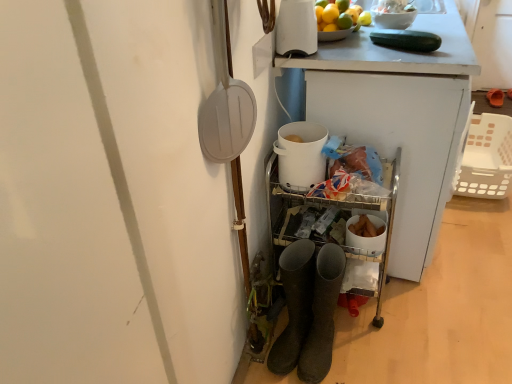
Question: Is white glossy bowl at upper right looking in the opposite direction of white glossy kettle at upper center, marked as the 1th appliance in a top-to-bottom arrangement?

Choices:
 (A) no
 (B) yes

Answer: (A)

Question: Are white glossy bowl at upper right and white glossy kettle at upper center, marked as the 1th appliance in a top-to-bottom arrangement, making contact?

Choices:
 (A) no
 (B) yes

Answer: (A)

Question: Is the depth of white glossy bowl at upper right greater than that of white glossy kettle at upper center, marked as the 1th appliance in a top-to-bottom arrangement?

Choices:
 (A) yes
 (B) no

Answer: (A)

Question: From the image's perspective, does white glossy bowl at upper right appear lower than white glossy kettle at upper center, marked as the 1th appliance in a top-to-bottom arrangement?

Choices:
 (A) no
 (B) yes

Answer: (A)

Question: Does white glossy bowl at upper right have a smaller size compared to white glossy kettle at upper center, marked as the 1th appliance in a top-to-bottom arrangement?

Choices:
 (A) no
 (B) yes

Answer: (B)

Question: Does point (501, 91) appear closer or farther from the camera than point (329, 342)?

Choices:
 (A) farther
 (B) closer

Answer: (A)

Question: In terms of height, does orange rubber boots at lower right, the second footwear positioned from the front, look taller or shorter compared to dark brown suede boots at lower center, positioned as the second footwear in top-to-bottom order?

Choices:
 (A) tall
 (B) short

Answer: (B)

Question: Based on their sizes in the image, would you say orange rubber boots at lower right, which is the first footwear in right-to-left order, is bigger or smaller than dark brown suede boots at lower center, which is counted as the 1th footwear, starting from the left?

Choices:
 (A) big
 (B) small

Answer: (B)

Question: Is orange rubber boots at lower right, positioned as the first footwear in top-to-bottom order, to the left or to the right of dark brown suede boots at lower center, which is counted as the 1th footwear, starting from the left, in the image?

Choices:
 (A) left
 (B) right

Answer: (B)

Question: Considering the positions of white glossy bowl at upper right and white plastic basket at right in the image, is white glossy bowl at upper right wider or thinner than white plastic basket at right?

Choices:
 (A) wide
 (B) thin

Answer: (B)

Question: From a real-world perspective, is white glossy bowl at upper right physically located above or below white plastic basket at right?

Choices:
 (A) above
 (B) below

Answer: (A)

Question: From their relative heights in the image, would you say white glossy bowl at upper right is taller or shorter than white plastic basket at right?

Choices:
 (A) tall
 (B) short

Answer: (B)

Question: Considering the positions of white glossy bowl at upper right and white plastic basket at right in the image, is white glossy bowl at upper right bigger or smaller than white plastic basket at right?

Choices:
 (A) small
 (B) big

Answer: (A)

Question: In the image, is white plastic basket at right positioned in front of or behind white matte bucket at center, the 1th appliance ordered from the bottom?

Choices:
 (A) behind
 (B) front

Answer: (A)

Question: Is white plastic basket at right inside the boundaries of white matte bucket at center, the 1th appliance ordered from the bottom, or outside?

Choices:
 (A) inside
 (B) outside

Answer: (B)